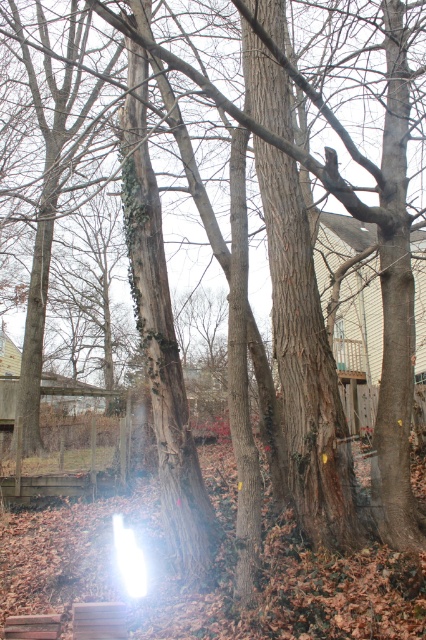
Question: Considering the relative positions of brown wooden bench at lower left and brown wooden plank at lower left in the image provided, where is brown wooden bench at lower left located with respect to brown wooden plank at lower left?

Choices:
 (A) above
 (B) below

Answer: (B)

Question: Is brown wooden bench at lower left thinner than brown wooden plank at lower left?

Choices:
 (A) yes
 (B) no

Answer: (B)

Question: Which point is closer to the camera?

Choices:
 (A) 92,625
 (B) 29,628

Answer: (B)

Question: Among these points, which one is nearest to the camera?

Choices:
 (A) (111, 602)
 (B) (45, 616)

Answer: (B)

Question: Is brown wooden bench at lower left thinner than brown wooden plank at lower left?

Choices:
 (A) yes
 (B) no

Answer: (B)

Question: Which point is farther to the camera?

Choices:
 (A) brown wooden bench at lower left
 (B) brown wooden plank at lower left

Answer: (A)